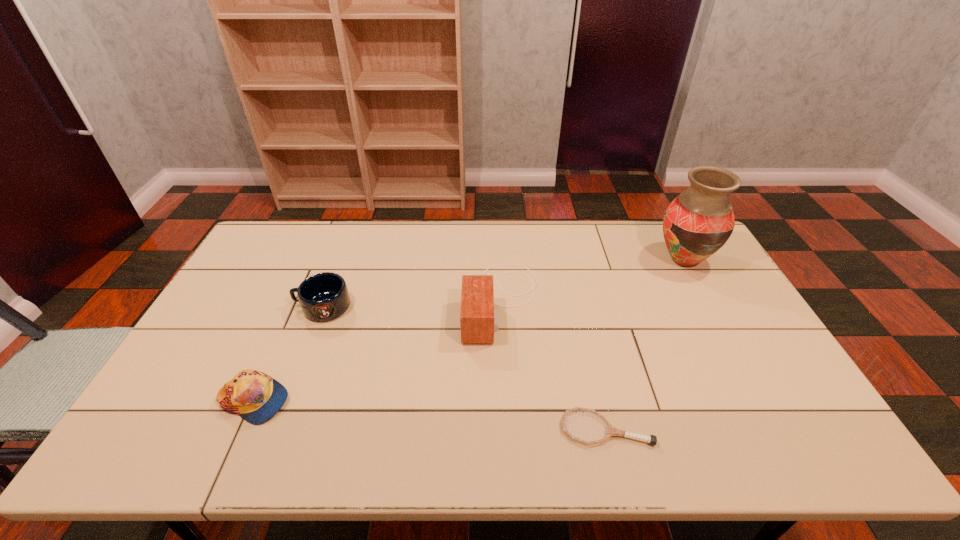
Locate an element on the screen. This screenshot has height=540, width=960. object positioned at the left edge is located at coordinates (256, 397).

What are the coordinates of `object positioned at the right edge` in the screenshot? It's located at (697, 223).

You are a GUI agent. You are given a task and a screenshot of the screen. Output one action in this format:
    pyautogui.click(x=<x>, y=<y>)
    Task: Click on the object at the near left corner
    
    Given the screenshot: What is the action you would take?
    pyautogui.click(x=256, y=397)

Where is `object that is at the far right corner`? object that is at the far right corner is located at coordinates (697, 223).

This screenshot has width=960, height=540. In order to click on free location at the far edge of the desktop in this screenshot , I will do `click(302, 248)`.

Locate an element on the screen. This screenshot has width=960, height=540. vacant space at the near edge is located at coordinates (590, 431).

Image resolution: width=960 pixels, height=540 pixels. What are the coordinates of `vacant space at the left edge` in the screenshot? It's located at (243, 303).

This screenshot has width=960, height=540. In the image, there is a desktop. Identify the location of free space at the right edge. (767, 377).

The height and width of the screenshot is (540, 960). In order to click on free region at the near left corner in this screenshot , I will do `click(151, 448)`.

You are a GUI agent. You are given a task and a screenshot of the screen. Output one action in this format:
    pyautogui.click(x=<x>, y=<y>)
    Task: Click on the free point between the second object from right to left and the mug
    This screenshot has width=960, height=540.
    Given the screenshot: What is the action you would take?
    pyautogui.click(x=465, y=368)